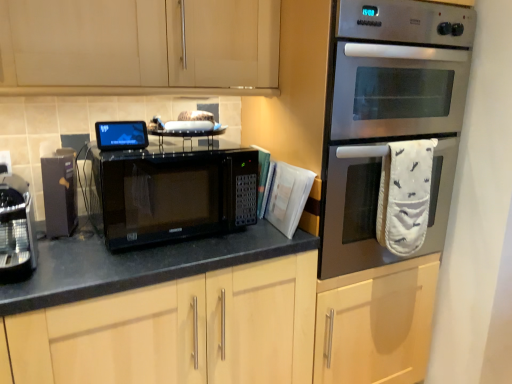
Based on the photo, how much space does sleek metallic coffee machine at left, the 3th appliance in the right-to-left sequence, occupy horizontally?

The width of sleek metallic coffee machine at left, the 3th appliance in the right-to-left sequence, is 10.96 inches.

Measure the distance between matte black microwave at center, marked as the 1th appliance in a right-to-left arrangement, and camera.

matte black microwave at center, marked as the 1th appliance in a right-to-left arrangement, and camera are 1.27 meters apart.

The width and height of the screenshot is (512, 384). What do you see at coordinates (60, 193) in the screenshot?
I see `matte black coffee machine at left, the 2th appliance positioned from the right` at bounding box center [60, 193].

Measure the distance between stainless steel oven at right and camera.

stainless steel oven at right is 3.93 feet away from camera.

At what (x,y) coordinates should I click in order to perform the action: click on sleek metallic coffee machine at left, acting as the 1th appliance starting from the left. Please return your answer as a coordinate pair (x, y). Image resolution: width=512 pixels, height=384 pixels. Looking at the image, I should click on (16, 228).

Are matte black microwave at center, marked as the 1th appliance in a right-to-left arrangement, and sleek metallic coffee machine at left, acting as the 1th appliance starting from the left, far apart?

No, there isn't a large distance between matte black microwave at center, marked as the 1th appliance in a right-to-left arrangement, and sleek metallic coffee machine at left, acting as the 1th appliance starting from the left.

Is matte black microwave at center, acting as the 3th appliance starting from the left, facing towards sleek metallic coffee machine at left, the 3th appliance in the right-to-left sequence?

No, matte black microwave at center, acting as the 3th appliance starting from the left, is not facing towards sleek metallic coffee machine at left, the 3th appliance in the right-to-left sequence.

Which object is more forward, matte black microwave at center, acting as the 3th appliance starting from the left, or sleek metallic coffee machine at left, the 3th appliance in the right-to-left sequence?

sleek metallic coffee machine at left, the 3th appliance in the right-to-left sequence.

Is matte black microwave at center, acting as the 3th appliance starting from the left, thinner than sleek metallic coffee machine at left, acting as the 1th appliance starting from the left?

Indeed, matte black microwave at center, acting as the 3th appliance starting from the left, has a lesser width compared to sleek metallic coffee machine at left, acting as the 1th appliance starting from the left.

Choose the correct answer: Is black matte microwave at center inside stainless steel oven at right or outside it?

black matte microwave at center is spatially situated outside stainless steel oven at right.

From a real-world perspective, is black matte microwave at center physically above stainless steel oven at right?

No, from a real-world perspective, black matte microwave at center is not above stainless steel oven at right.

From the image's perspective, which one is positioned lower, black matte microwave at center or stainless steel oven at right?

From the image's view, black matte microwave at center is below.

Can we say matte black coffee machine at left, the 2th appliance positioned from the right, lies outside black matte microwave at center?

Yes, matte black coffee machine at left, the 2th appliance positioned from the right, is outside of black matte microwave at center.

Looking at this image, is matte black coffee machine at left, the second appliance viewed from the left, placed right next to black matte microwave at center?

matte black coffee machine at left, the second appliance viewed from the left, is not next to black matte microwave at center, and they're not touching.

Is matte black coffee machine at left, the 2th appliance positioned from the right, closer to the viewer compared to black matte microwave at center?

No, it is behind black matte microwave at center.

How many degrees apart are the facing directions of matte black coffee machine at left, the 2th appliance positioned from the right, and black matte microwave at center?

The angle between the facing direction of matte black coffee machine at left, the 2th appliance positioned from the right, and the facing direction of black matte microwave at center is 18.2 degrees.

Which point is more distant from viewer, (x=5, y=268) or (x=63, y=181)?

Point (x=63, y=181)

Which of these two, sleek metallic coffee machine at left, acting as the 1th appliance starting from the left, or matte black coffee machine at left, the 2th appliance positioned from the right, is bigger?

sleek metallic coffee machine at left, acting as the 1th appliance starting from the left.

Is sleek metallic coffee machine at left, acting as the 1th appliance starting from the left, directly adjacent to matte black coffee machine at left, the 2th appliance positioned from the right?

No, sleek metallic coffee machine at left, acting as the 1th appliance starting from the left, is not touching matte black coffee machine at left, the 2th appliance positioned from the right.

Looking at this image, is sleek metallic coffee machine at left, acting as the 1th appliance starting from the left, further to the viewer compared to matte black coffee machine at left, the 2th appliance positioned from the right?

No.

Where is `cabinetry below the matte black coffee machine at left, the second appliance viewed from the left (from a real-world perspective)`? The image size is (512, 384). cabinetry below the matte black coffee machine at left, the second appliance viewed from the left (from a real-world perspective) is located at coordinates pyautogui.click(x=237, y=328).

Is matte black microwave at center at the back of matte black coffee machine at left, the second appliance viewed from the left?

No, matte black microwave at center is not at the back of matte black coffee machine at left, the second appliance viewed from the left.

Would you say matte black coffee machine at left, the 2th appliance positioned from the right, is inside or outside matte black microwave at center?

matte black coffee machine at left, the 2th appliance positioned from the right, cannot be found inside matte black microwave at center.

Which of these two, matte black coffee machine at left, the second appliance viewed from the left, or matte black microwave at center, is wider?

Wider between the two is matte black microwave at center.

Considering the positions of objects black matte microwave at center and matte black coffee machine at left, the second appliance viewed from the left, in the image provided, who is more to the left, black matte microwave at center or matte black coffee machine at left, the second appliance viewed from the left,?

matte black coffee machine at left, the second appliance viewed from the left, is more to the left.

Is black matte microwave at center situated inside matte black coffee machine at left, the second appliance viewed from the left, or outside?

black matte microwave at center lies outside matte black coffee machine at left, the second appliance viewed from the left.

Consider the image. Can you see black matte microwave at center touching matte black coffee machine at left, the second appliance viewed from the left?

black matte microwave at center is not next to matte black coffee machine at left, the second appliance viewed from the left, and they're not touching.

From the image's perspective, which one is positioned higher, black matte microwave at center or matte black microwave at center?

From the image's view, black matte microwave at center is above.

Is black matte microwave at center spatially inside matte black microwave at center, or outside of it?

black matte microwave at center is not enclosed by matte black microwave at center.

The height and width of the screenshot is (384, 512). Identify the location of the 1st appliance behind when counting from the sleek metallic coffee machine at left, the 3th appliance in the right-to-left sequence. (121, 135).

Where is `microwave oven on the left side of stainless steel oven at right`? The image size is (512, 384). microwave oven on the left side of stainless steel oven at right is located at coordinates (170, 194).

When comparing their distances from stainless steel oven at right, does black matte microwave at center or matte black microwave at center, acting as the 3th appliance starting from the left, seem closer?

Among the two, black matte microwave at center is located nearer to stainless steel oven at right.

Based on their spatial positions, is matte black microwave at center, acting as the 3th appliance starting from the left, or matte black coffee machine at left, the 2th appliance positioned from the right, closer to stainless steel oven at right?

matte black microwave at center, acting as the 3th appliance starting from the left.

Based on their spatial positions, is black matte microwave at center or sleek metallic coffee machine at left, the 3th appliance in the right-to-left sequence, further from matte black microwave at center?

The object further to matte black microwave at center is sleek metallic coffee machine at left, the 3th appliance in the right-to-left sequence.

From the image, which object appears to be nearer to matte black microwave at center, marked as the 1th appliance in a right-to-left arrangement, sleek metallic coffee machine at left, the 3th appliance in the right-to-left sequence, or black matte microwave at center?

Based on the image, black matte microwave at center appears to be nearer to matte black microwave at center, marked as the 1th appliance in a right-to-left arrangement.

From the image, which object appears to be nearer to matte black microwave at center, matte black microwave at center, acting as the 3th appliance starting from the left, or stainless steel oven at right?

stainless steel oven at right is closer to matte black microwave at center.

Looking at this image, considering their positions, is sleek metallic coffee machine at left, acting as the 1th appliance starting from the left, positioned closer to matte black microwave at center, acting as the 3th appliance starting from the left, than stainless steel oven at right?

sleek metallic coffee machine at left, acting as the 1th appliance starting from the left, lies closer to matte black microwave at center, acting as the 3th appliance starting from the left, than the other object.

Which object lies further to the anchor point matte black coffee machine at left, the 2th appliance positioned from the right, sleek metallic coffee machine at left, acting as the 1th appliance starting from the left, or stainless steel oven at right?

stainless steel oven at right.

Estimate the real-world distances between objects in this image. Which object is further from stainless steel oven at right, matte black microwave at center or black matte microwave at center?

The object further to stainless steel oven at right is black matte microwave at center.

What are the coordinates of `microwave oven between sleek metallic coffee machine at left, the 3th appliance in the right-to-left sequence, and stainless steel oven at right from left to right` in the screenshot? It's located at (170, 194).

At what (x,y) coordinates should I click in order to perform the action: click on microwave oven that lies between matte black coffee machine at left, the second appliance viewed from the left, and matte black microwave at center from top to bottom. Please return your answer as a coordinate pair (x, y). The image size is (512, 384). Looking at the image, I should click on (170, 194).

The width and height of the screenshot is (512, 384). Identify the location of cabinetry situated between matte black coffee machine at left, the second appliance viewed from the left, and stainless steel oven at right from left to right. (237, 328).

Where is `microwave oven between matte black microwave at center, acting as the 3th appliance starting from the left, and stainless steel oven at right, in the horizontal direction`? This screenshot has height=384, width=512. microwave oven between matte black microwave at center, acting as the 3th appliance starting from the left, and stainless steel oven at right, in the horizontal direction is located at coordinates (170, 194).